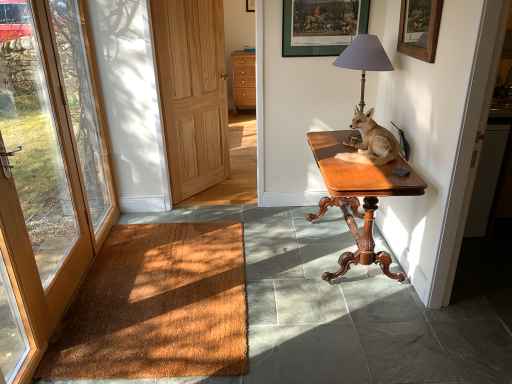
Locate an element on the screen. This screenshot has width=512, height=384. vacant region above brown coir mat at lower left (from a real-world perspective) is located at coordinates (165, 278).